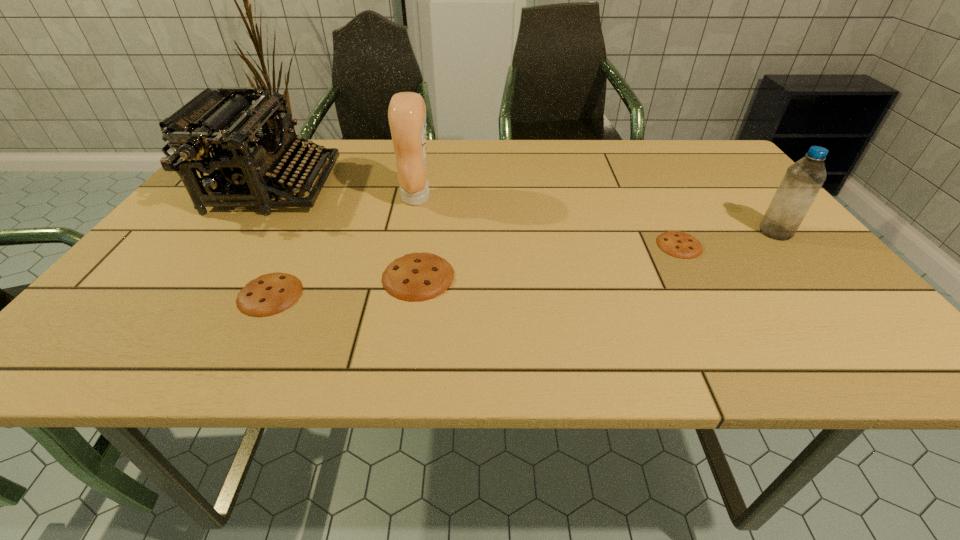
What are the coordinates of `the leftmost cookie` in the screenshot? It's located at (271, 293).

The image size is (960, 540). Identify the location of the second shortest object. (271, 293).

In order to click on the fourth tallest object in this screenshot , I will do `click(416, 276)`.

The width and height of the screenshot is (960, 540). Find the location of `the tallest cookie`. the tallest cookie is located at coordinates click(416, 276).

The image size is (960, 540). In order to click on the shortest cookie in this screenshot , I will do `click(675, 243)`.

Locate an element on the screen. the shortest object is located at coordinates (675, 243).

Locate an element on the screen. This screenshot has height=540, width=960. typewriter is located at coordinates (226, 119).

What are the coordinates of `the rightmost object` in the screenshot? It's located at (802, 181).

What are the coordinates of `condiment` in the screenshot? It's located at (407, 111).

Identify the location of free space located 0.270m on the right of the leftmost cookie. (438, 294).